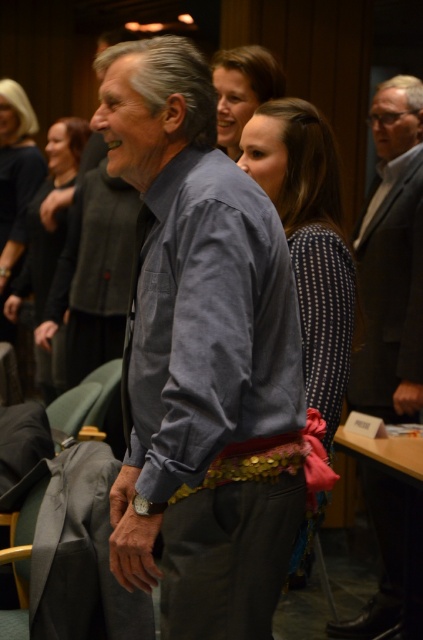
You are a photographer at the event and want to capture a clear shot of the denim shirt at center without the smooth brown hair at upper center blocking it. How should you adjust your camera angle?

The denim shirt at center is in front of the smooth brown hair at upper center, so to avoid blocking, you should angle the camera slightly upward to focus on the denim shirt at center while moving the smooth brown hair at upper center out of the frame.

You are a photographer trying to capture a clear shot of the matte black dress at center and the smooth brown hair at upper center. Which object is closer to the camera?

The matte black dress at center is closer to the camera than the smooth brown hair at upper center because it is further to the viewer.

You are a photographer at a press event and need to capture a clear shot of the matte black dress at center and the smooth brown hair at upper center. Which object should you focus on first if you want to prioritize the one that is closer to the camera?

The smooth brown hair at upper center is closer to the camera than the matte black dress at center because the dress is much taller, so you should focus on the smooth brown hair at upper center first.